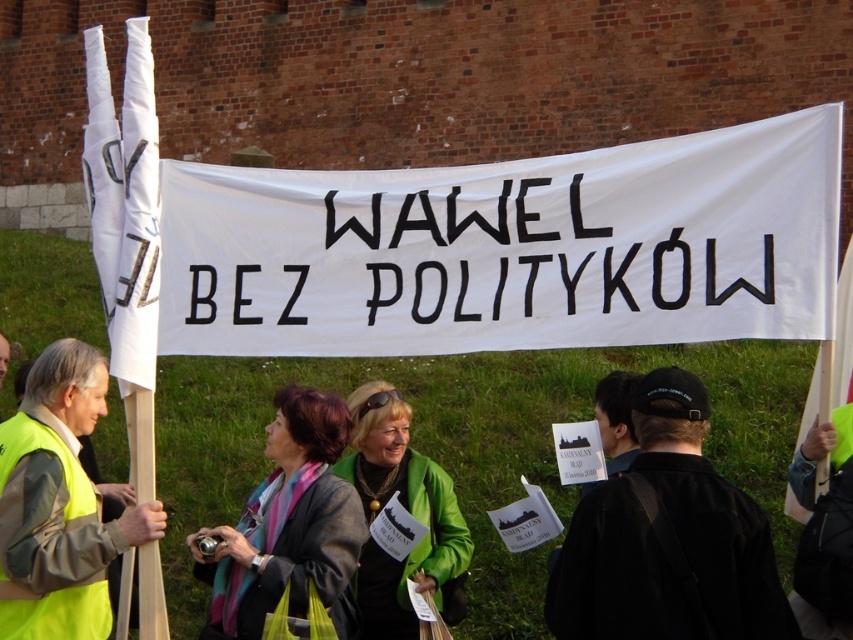
Question: Is black fabric cap at upper center positioned in front of green leather jacket at center?

Choices:
 (A) yes
 (B) no

Answer: (A)

Question: Does black fabric cap at upper center have a smaller size compared to gray woolen jacket at center?

Choices:
 (A) yes
 (B) no

Answer: (A)

Question: Which point is farther to the camera?

Choices:
 (A) white paper flag at center
 (B) neon yellow vest at center

Answer: (A)

Question: Which point is farther to the camera?

Choices:
 (A) black fabric cap at upper center
 (B) green leather jacket at center
 (C) neon yellow vest at center
 (D) white paper banner at center

Answer: (B)

Question: Which object is closer to the camera taking this photo?

Choices:
 (A) white paper flag at center
 (B) green leather jacket at center
 (C) black fabric cap at upper center

Answer: (C)

Question: Is black fabric cap at upper center positioned in front of neon yellow vest at center?

Choices:
 (A) yes
 (B) no

Answer: (A)